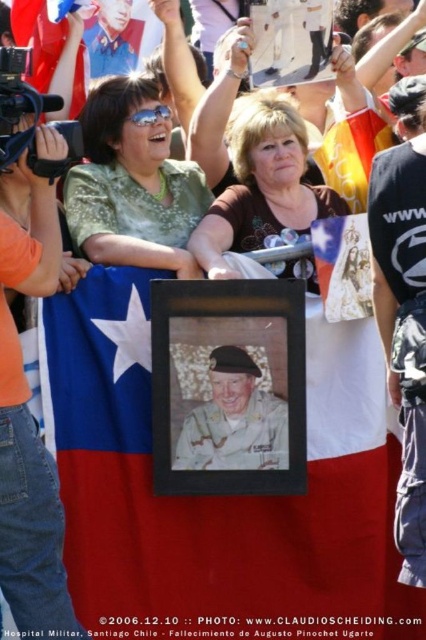
Question: Does matte black photo frame at center appear on the right side of green textured blouse at upper center?

Choices:
 (A) no
 (B) yes

Answer: (A)

Question: Based on their relative distances, which object is nearer to the green textured blouse at upper center?

Choices:
 (A) blue uniform at upper left
 (B) brown matte shirt at center
 (C) red fabric flag at upper left
 (D) matte black photo frame at center

Answer: (B)

Question: Which point is closer to the camera?

Choices:
 (A) camouflage uniform at center
 (B) blue uniform at upper left

Answer: (A)

Question: Is brown matte shirt at center positioned behind blue uniform at upper left?

Choices:
 (A) no
 (B) yes

Answer: (A)

Question: Estimate the real-world distances between objects in this image. Which object is closer to the red fabric flag at center?

Choices:
 (A) blue uniform at upper left
 (B) green textured blouse at upper center
 (C) brown matte shirt at center
 (D) red fabric flag at upper left

Answer: (C)

Question: Considering the relative positions of brown matte shirt at center and blue uniform at upper left in the image provided, where is brown matte shirt at center located with respect to blue uniform at upper left?

Choices:
 (A) right
 (B) left

Answer: (A)